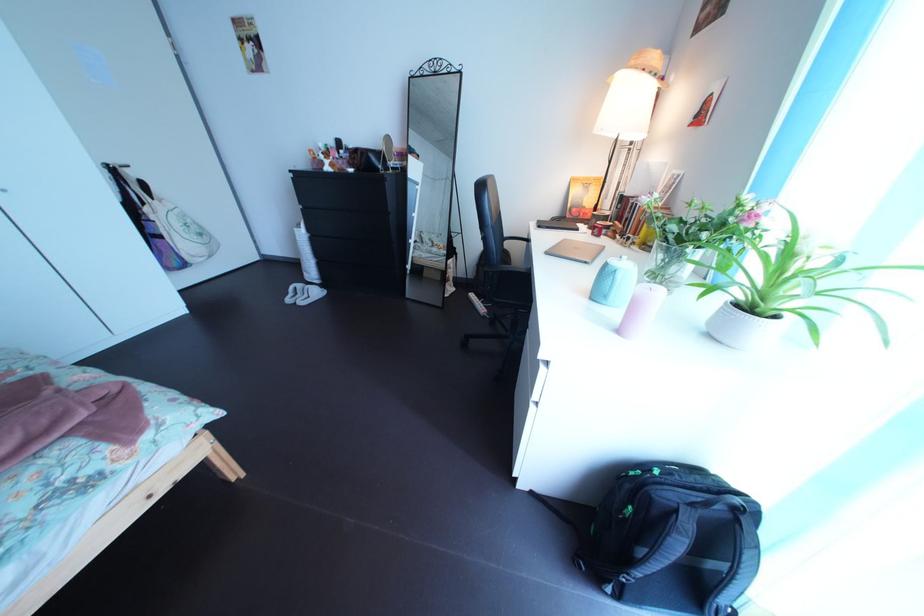
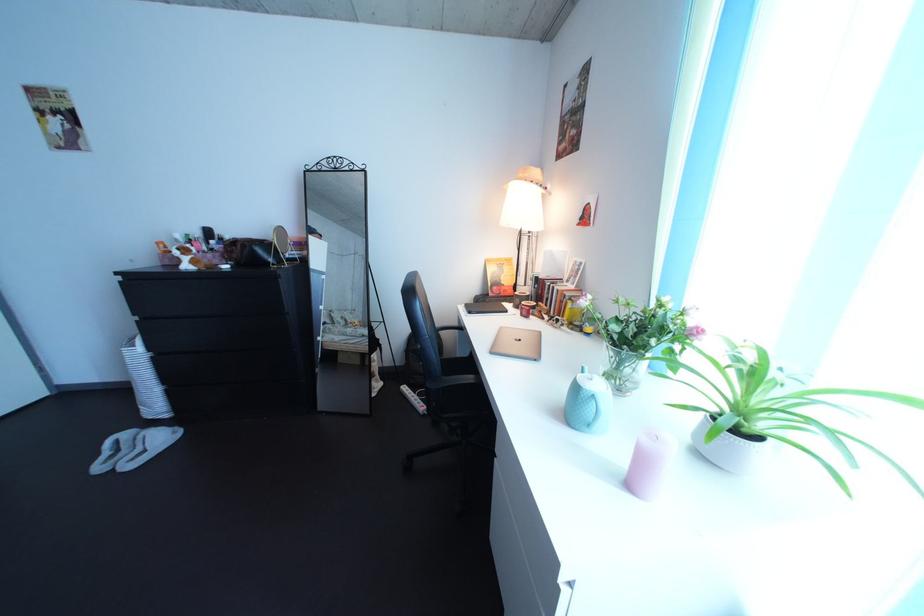
Question: Which direction would the cameraman need to move to produce the second image? Reply with the corresponding letter.

Choices:
 (A) Left
 (B) Right
 (C) Forward
 (D) Backward

Answer: (C)